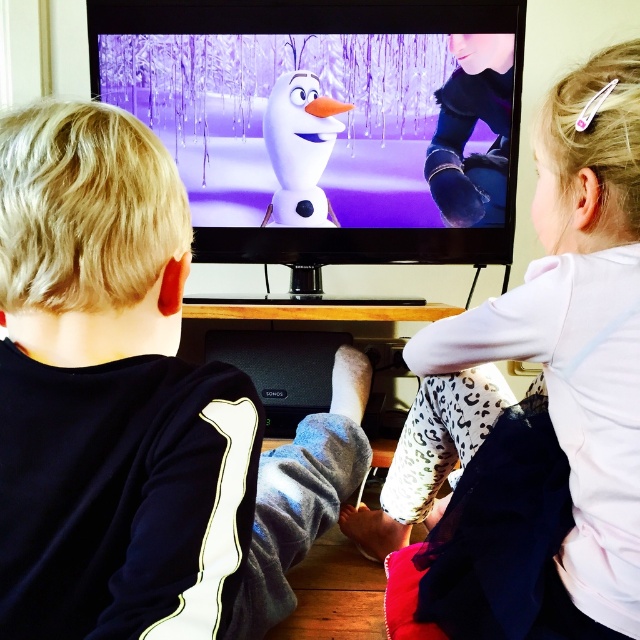
Question: Can you confirm if black fleece shirt at left is wider than white leopard print pants at lower right?

Choices:
 (A) no
 (B) yes

Answer: (A)

Question: Among these objects, which one is farthest from the camera?

Choices:
 (A) white leopard print pants at lower right
 (B) white matte snowman at center

Answer: (B)

Question: Which point is farther to the camera?

Choices:
 (A) black fleece shirt at left
 (B) white leopard print pants at lower right
 (C) white matte snowman at center
 (D) matte white snowman at center

Answer: (D)

Question: Does black fleece shirt at left appear under white matte snowman at center?

Choices:
 (A) yes
 (B) no

Answer: (A)

Question: Can you confirm if black fleece shirt at left is wider than white matte snowman at center?

Choices:
 (A) yes
 (B) no

Answer: (B)

Question: Among these points, which one is nearest to the camera?

Choices:
 (A) (259, 4)
 (B) (630, 515)

Answer: (B)